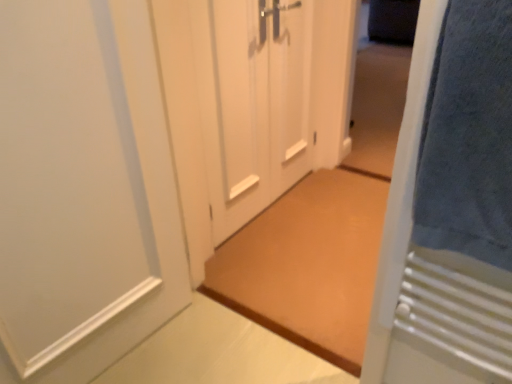
Question: Is blue soft towel at right to the right of white matte door at left, the first door when ordered from left to right, from the viewer's perspective?

Choices:
 (A) yes
 (B) no

Answer: (A)

Question: Could you tell me if blue soft towel at right is facing white matte door at left, the first door when ordered from left to right?

Choices:
 (A) no
 (B) yes

Answer: (A)

Question: Is blue soft towel at right positioned behind white matte door at left, the first door when ordered from left to right?

Choices:
 (A) no
 (B) yes

Answer: (A)

Question: Is blue soft towel at right far from white matte door at left, which appears as the fourth door when viewed from the right?

Choices:
 (A) no
 (B) yes

Answer: (A)

Question: Considering the relative sizes of blue soft towel at right and white matte door at left, which appears as the fourth door when viewed from the right, in the image provided, is blue soft towel at right thinner than white matte door at left, which appears as the fourth door when viewed from the right,?

Choices:
 (A) yes
 (B) no

Answer: (A)

Question: Looking at the image, does white matte door at left, which appears as the fourth door when viewed from the right, seem bigger or smaller compared to white matte door at center, which is the third door from right to left?

Choices:
 (A) small
 (B) big

Answer: (B)

Question: Is white matte door at left, which appears as the fourth door when viewed from the right, wider or thinner than white matte door at center, which is the third door from right to left?

Choices:
 (A) wide
 (B) thin

Answer: (A)

Question: Is white matte door at left, the first door when ordered from left to right, in front of or behind white matte door at center, which is the third door from right to left, in the image?

Choices:
 (A) front
 (B) behind

Answer: (A)

Question: From a real-world perspective, is white matte door at left, which appears as the fourth door when viewed from the right, positioned above or below white matte door at center, the second door in the left-to-right sequence?

Choices:
 (A) below
 (B) above

Answer: (B)

Question: Considering the positions of point (486, 223) and point (296, 140), is point (486, 223) closer or farther from the camera than point (296, 140)?

Choices:
 (A) closer
 (B) farther

Answer: (A)

Question: Considering their positions, is blue towel at right, which is counted as the 4th door, starting from the left, located in front of or behind white matte door at center, placed as the 3th door when sorted from left to right?

Choices:
 (A) behind
 (B) front

Answer: (B)

Question: Is blue towel at right, which is counted as the 4th door, starting from the left, bigger or smaller than white matte door at center, acting as the 2th door starting from the right?

Choices:
 (A) small
 (B) big

Answer: (A)

Question: Do you think blue towel at right, which is counted as the 4th door, starting from the left, is within white matte door at center, acting as the 2th door starting from the right, or outside of it?

Choices:
 (A) outside
 (B) inside

Answer: (A)

Question: Which is correct: blue soft towel at right is inside white matte door at left, the first door when ordered from left to right, or outside of it?

Choices:
 (A) inside
 (B) outside

Answer: (B)

Question: In terms of width, does blue soft towel at right look wider or thinner when compared to white matte door at left, which appears as the fourth door when viewed from the right?

Choices:
 (A) wide
 (B) thin

Answer: (B)